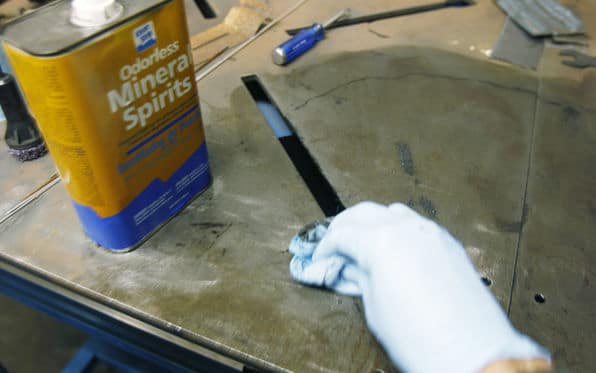
Identify the location of work surface. (263, 239).